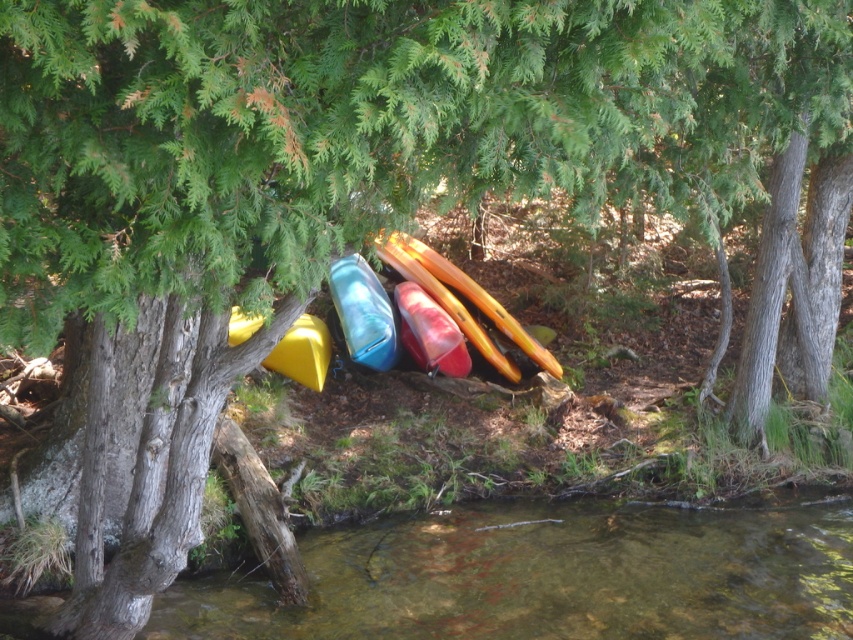
Question: Does translucent blue kayak at center have a smaller size compared to matte red canoe at center?

Choices:
 (A) yes
 (B) no

Answer: (B)

Question: Considering the relative positions of translucent blue kayak at center and matte red canoe at center in the image provided, where is translucent blue kayak at center located with respect to matte red canoe at center?

Choices:
 (A) above
 (B) below

Answer: (A)

Question: Based on their relative distances, which object is nearer to the matte red canoe at center?

Choices:
 (A) yellow matte kayak at center
 (B) translucent blue kayak at center
 (C) clear water at lower center

Answer: (B)

Question: Is matte red canoe at center above translucent red kayak at center?

Choices:
 (A) no
 (B) yes

Answer: (B)

Question: Among these points, which one is farthest from the camera?

Choices:
 (A) (352, 323)
 (B) (445, 294)
 (C) (256, 609)

Answer: (B)

Question: Among these points, which one is nearest to the camera?

Choices:
 (A) (486, 563)
 (B) (386, 243)

Answer: (B)